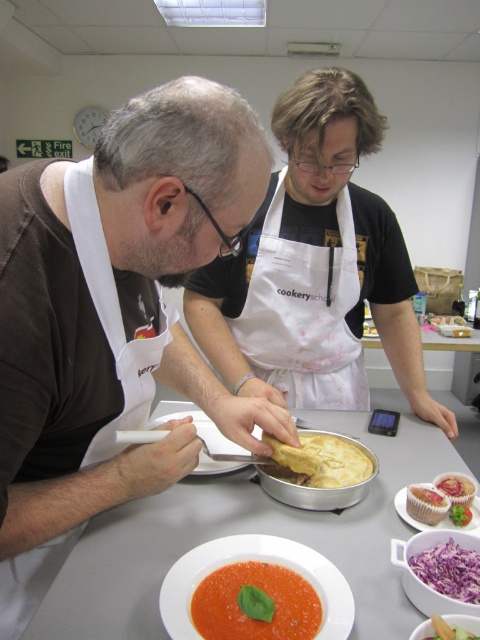
Consider the image. You are a chef in a cooking class and need to choose between the tomato puree at center and the green leafy vegetable at center for a recipe that requires a larger ingredient. Which one should you pick?

The tomato puree at center is larger in size than the green leafy vegetable at center, so you should pick the tomato puree at center for the recipe.

You are a food critic attending a cooking class. You notice two items on the table near the chef. Which item is wider between the purple shredded cabbage at lower center and the matte white cupcake at lower right?

The purple shredded cabbage at lower center is wider than the matte white cupcake at lower right according to the description.